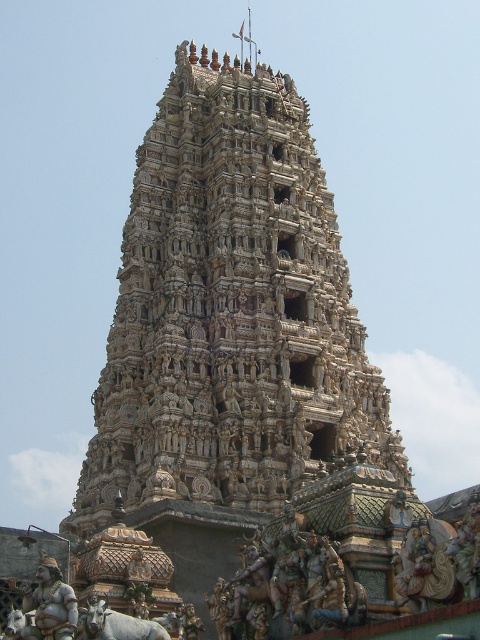
Question: Does carved stone temple at center have a larger size compared to multicolored carved figures at lower center?

Choices:
 (A) no
 (B) yes

Answer: (B)

Question: Is carved stone temple at center wider than golden carved statue at center?

Choices:
 (A) no
 (B) yes

Answer: (B)

Question: Can you confirm if carved stone temple at center is thinner than golden polished statue at lower left?

Choices:
 (A) yes
 (B) no

Answer: (B)

Question: Which object is the farthest from the golden polished statue at lower left?

Choices:
 (A) golden carved statue at center
 (B) carved stone temple at center

Answer: (B)

Question: Estimate the real-world distances between objects in this image. Which object is closer to the carved stone temple at center?

Choices:
 (A) multicolored carved figures at lower center
 (B) golden polished statue at lower left

Answer: (A)

Question: Which object is the farthest from the golden polished statue at lower left?

Choices:
 (A) multicolored carved figures at lower center
 (B) carved stone temple at center
 (C) golden carved statue at center

Answer: (B)